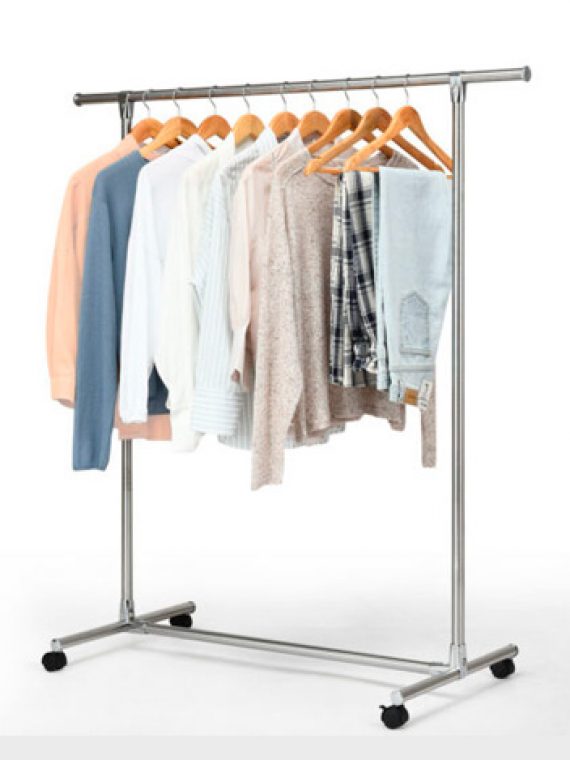
The height and width of the screenshot is (760, 570). I want to click on hanger, so click(x=142, y=127), click(x=169, y=128), click(x=209, y=127), click(x=241, y=131), click(x=285, y=122), click(x=307, y=122), click(x=339, y=122), click(x=364, y=127), click(x=405, y=119).